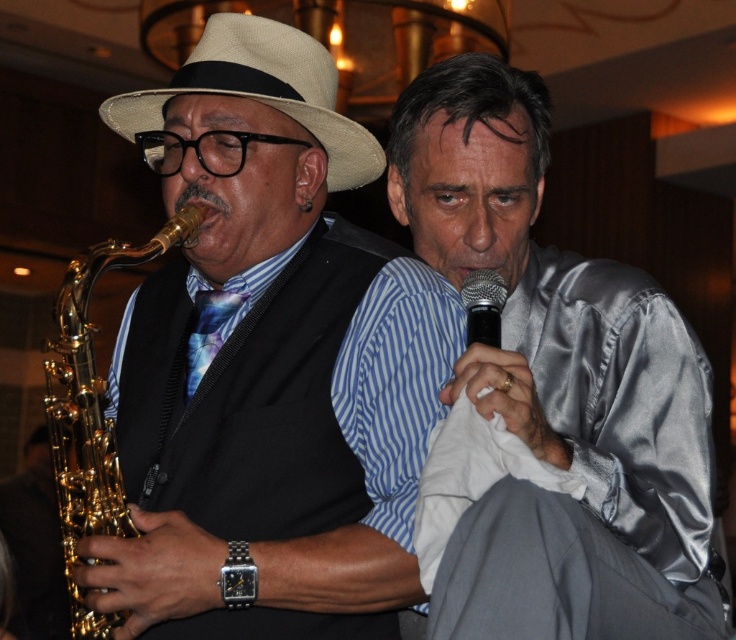
Question: Which point is farther to the camera?

Choices:
 (A) (238, 300)
 (B) (166, 163)

Answer: (A)

Question: Can you confirm if silver satin shirt at right is positioned above natural straw fedora at upper left?

Choices:
 (A) no
 (B) yes

Answer: (A)

Question: Which point is farther to the camera?

Choices:
 (A) black metallic microphone at center
 (B) shiny blue tie at center

Answer: (B)

Question: Among these points, which one is nearest to the camera?

Choices:
 (A) (297, 81)
 (B) (690, 547)

Answer: (A)

Question: Is the position of gold shiny saxophone at left more distant than that of natural straw fedora at upper left?

Choices:
 (A) yes
 (B) no

Answer: (B)

Question: Is shiny gold saxophone at left smaller than natural straw fedora at upper left?

Choices:
 (A) no
 (B) yes

Answer: (A)